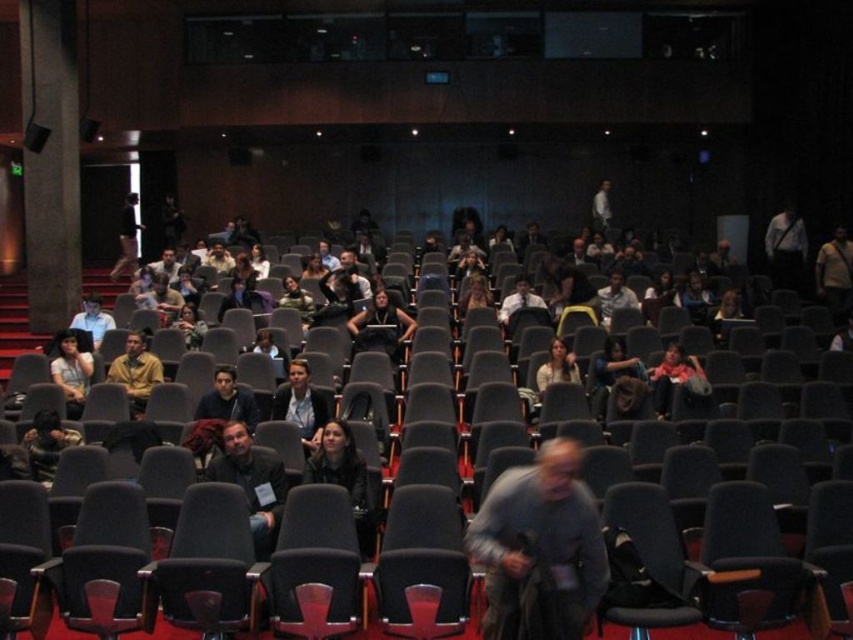
Question: Does gray fabric jacket at center appear on the left side of matte black jacket at center?

Choices:
 (A) yes
 (B) no

Answer: (B)

Question: Which object appears closest to the camera in this image?

Choices:
 (A) white shirt at upper center
 (B) dark brown leather jacket at upper center
 (C) dark gray jacket at center
 (D) light brown leather jacket at center

Answer: (C)

Question: Which of the following is the farthest from the observer?

Choices:
 (A) (219, 392)
 (B) (599, 531)

Answer: (A)

Question: Among these objects, which one is farthest from the camera?

Choices:
 (A) white shirt at upper right
 (B) matte white shirt at center
 (C) matte black jacket at center
 (D) white shirt at upper center

Answer: (D)

Question: From the image, what is the correct spatial relationship of gray fabric jacket at center in relation to dark blue jacket at center?

Choices:
 (A) right
 (B) left

Answer: (A)

Question: Does matte white shirt at center have a larger size compared to white shirt at upper center?

Choices:
 (A) yes
 (B) no

Answer: (B)